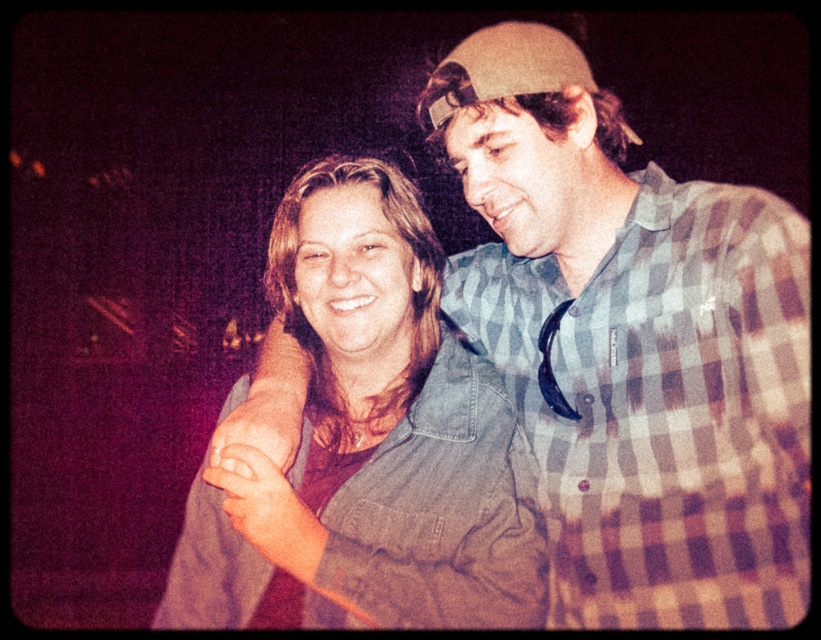
Can you confirm if checkered flannel shirt at upper right is smaller than denim jacket at center?

Actually, checkered flannel shirt at upper right might be larger than denim jacket at center.

Does checkered flannel shirt at upper right have a larger size compared to denim jacket at center?

Correct, checkered flannel shirt at upper right is larger in size than denim jacket at center.

Between point (774, 419) and point (308, 550), which one is positioned in front?

Point (774, 419)

The height and width of the screenshot is (640, 821). What are the coordinates of `checkered flannel shirt at upper right` in the screenshot? It's located at (664, 406).